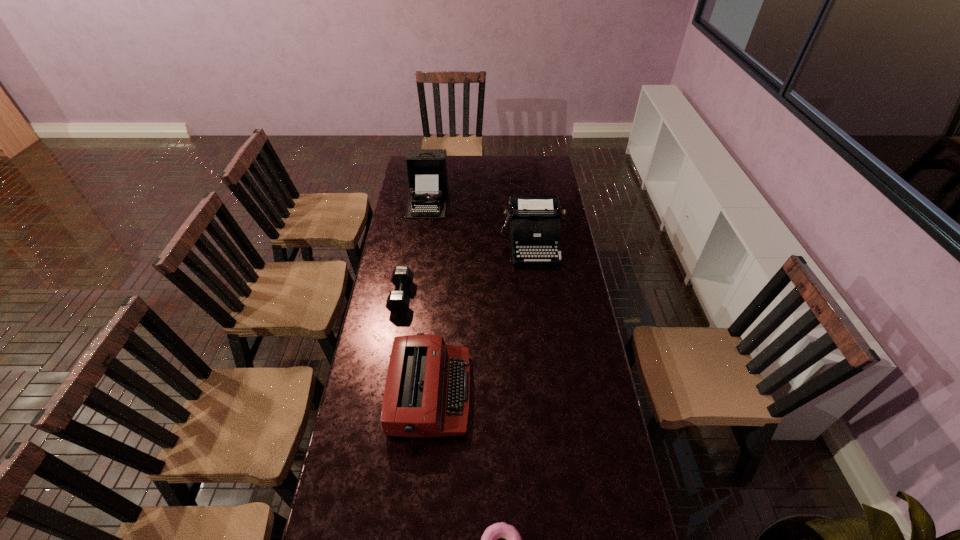
You are a GUI agent. You are given a task and a screenshot of the screen. Output one action in this format:
    pyautogui.click(x=<x>, y=<y>)
    Task: Click on the free spot between the nearest typewriter and the fourth shortest object
    
    Given the screenshot: What is the action you would take?
    pyautogui.click(x=481, y=318)

Where is `unoccupied position between the fourth tallest object and the rightmost typewriter`? The width and height of the screenshot is (960, 540). unoccupied position between the fourth tallest object and the rightmost typewriter is located at coordinates (467, 270).

The height and width of the screenshot is (540, 960). I want to click on free space between the farthest object and the third tallest object, so click(429, 296).

At what (x,y) coordinates should I click in order to perform the action: click on free space between the farthest object and the third farthest object. Please return your answer as a coordinate pair (x, y). Looking at the image, I should click on (415, 248).

The height and width of the screenshot is (540, 960). Find the location of `free spot between the shortest typewriter and the tallest typewriter`. free spot between the shortest typewriter and the tallest typewriter is located at coordinates (429, 296).

Identify which object is the second closest to the fourth farthest object. Please provide its 2D coordinates. Your answer should be formatted as a tuple, i.e. [(x, y)], where the tuple contains the x and y coordinates of a point satisfying the conditions above.

[(498, 530)]

Where is `object that is the closest one to the nearest typewriter`? Image resolution: width=960 pixels, height=540 pixels. object that is the closest one to the nearest typewriter is located at coordinates (398, 302).

What are the coordinates of `typewriter that stands as the closest to the third nearest object` in the screenshot? It's located at (427, 390).

I want to click on the closest typewriter to the dumbbell, so click(427, 390).

This screenshot has width=960, height=540. In order to click on free space that satisfies the following two spatial constraints: 1. on the typing side of the second tallest typewriter; 2. on the typing side of the shortest typewriter in this screenshot , I will do `click(551, 393)`.